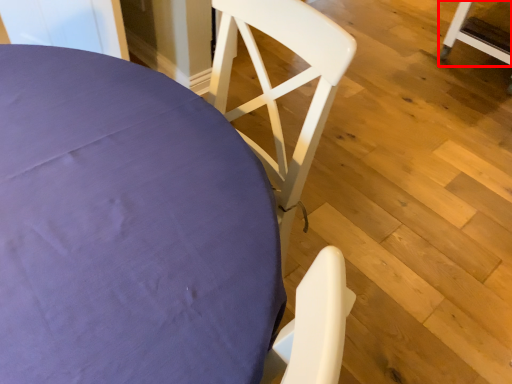
Question: From the image's perspective, what is the correct spatial relationship of chair (annotated by the red box) in relation to chair?

Choices:
 (A) below
 (B) above

Answer: (B)